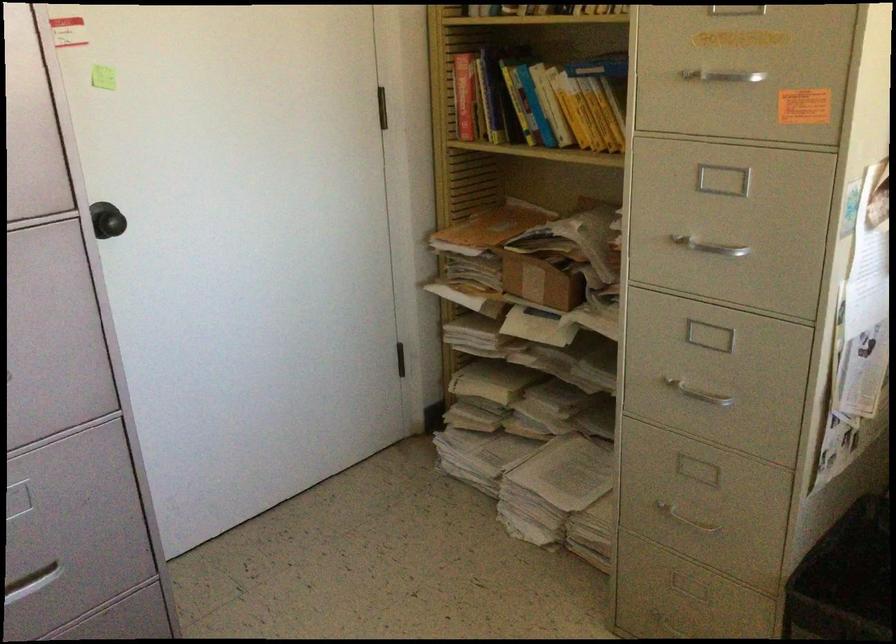
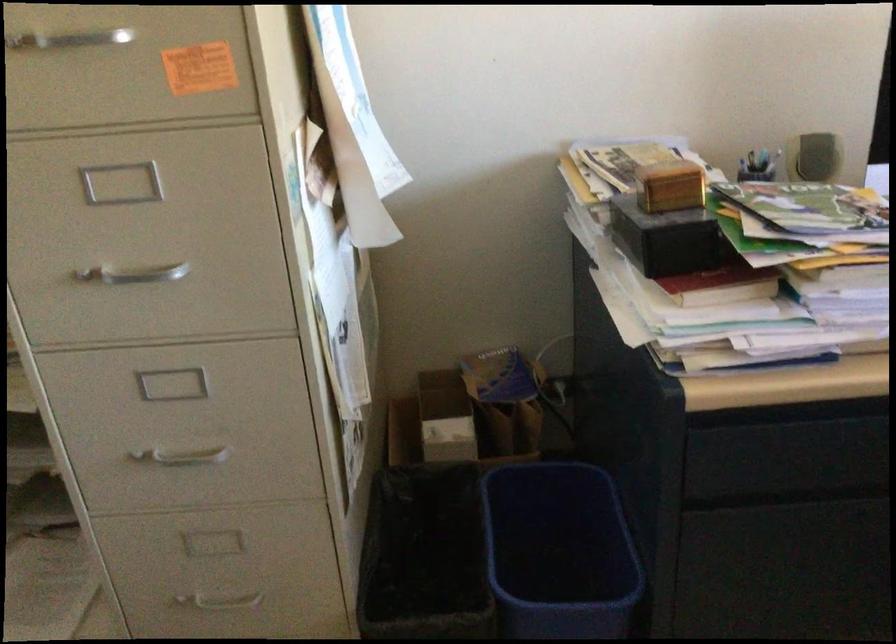
Where in the second image is the point corresponding to [718,82] from the first image?

(67, 40)